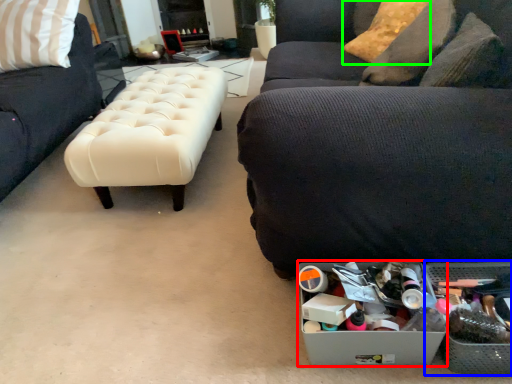
Question: Based on their relative distances, which object is farther from storage box (highlighted by a red box)? Choose from storage box (highlighted by a blue box) and pillow (highlighted by a green box).

Choices:
 (A) storage box
 (B) pillow

Answer: (B)